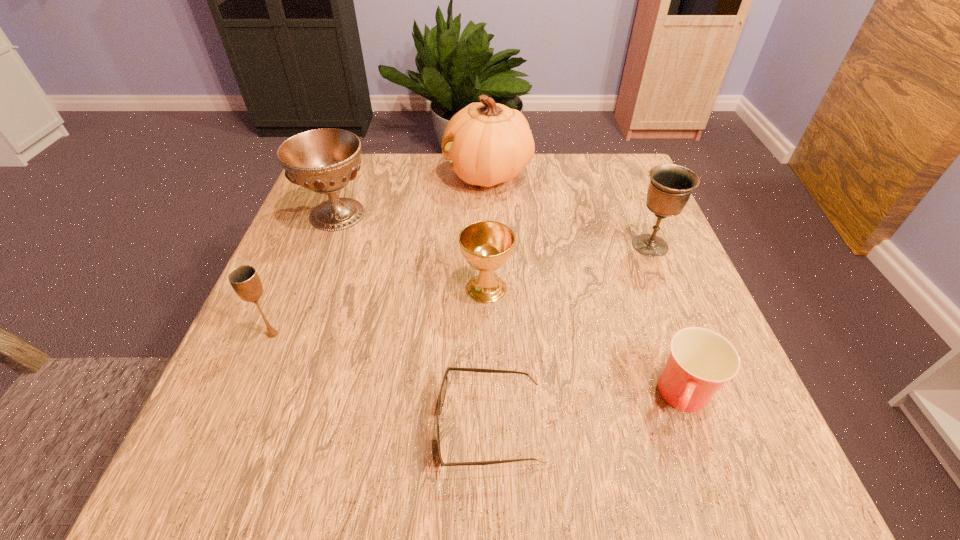
You are a GUI agent. You are given a task and a screenshot of the screen. Output one action in this format:
    pyautogui.click(x=<x>, y=<y>)
    Task: Click on the free space located 0.190m on the back of the rightmost chalice
    The image size is (960, 540).
    Given the screenshot: What is the action you would take?
    pyautogui.click(x=625, y=184)

Locate an element on the screen. The width and height of the screenshot is (960, 540). free space located 0.370m on the right of the nearest chalice is located at coordinates (493, 334).

This screenshot has width=960, height=540. I want to click on vacant space situated 0.180m on the right of the third chalice from left to right, so click(x=604, y=288).

Locate an element on the screen. The image size is (960, 540). vacant position located 0.150m on the back of the cup is located at coordinates (649, 299).

Locate an element on the screen. The height and width of the screenshot is (540, 960). free point located 0.320m on the lenses of the sunglasses is located at coordinates (224, 426).

The height and width of the screenshot is (540, 960). I want to click on vacant point located 0.220m on the lenses of the sunglasses, so click(x=291, y=426).

In order to click on free space located on the lenses of the sunglasses in this screenshot , I will do `click(345, 426)`.

Locate an element on the screen. The height and width of the screenshot is (540, 960). pumpkin located in the far edge section of the desktop is located at coordinates (487, 143).

The width and height of the screenshot is (960, 540). I want to click on chalice at the far edge, so (325, 160).

Identify the location of object present at the near edge. The image size is (960, 540). (443, 389).